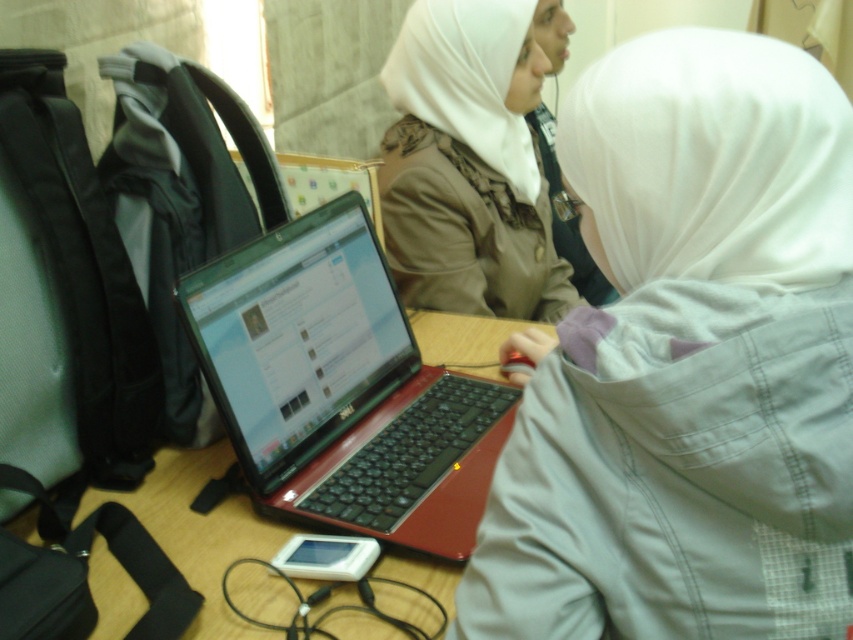
You are an observer looking at the scene. Which object is taller between the white matte hijab at center and the white soft veil at upper right?

The white matte hijab at center is taller than the white soft veil at upper right according to the description.

You are a photographer trying to capture a closeup of the shiny black laptop at center without including the white matte veil at upper center in the frame. Given their sizes, is it possible to do so?

The shiny black laptop at center is wider than the white matte veil at upper center. Since the laptop is wider, it might be challenging to frame the laptop closely without the veil appearing in the shot if they are positioned near each other. However, if there is sufficient space between them, adjusting the camera angle could exclude the veil. The exact possibility depends on their spatial arrangement not specified here.